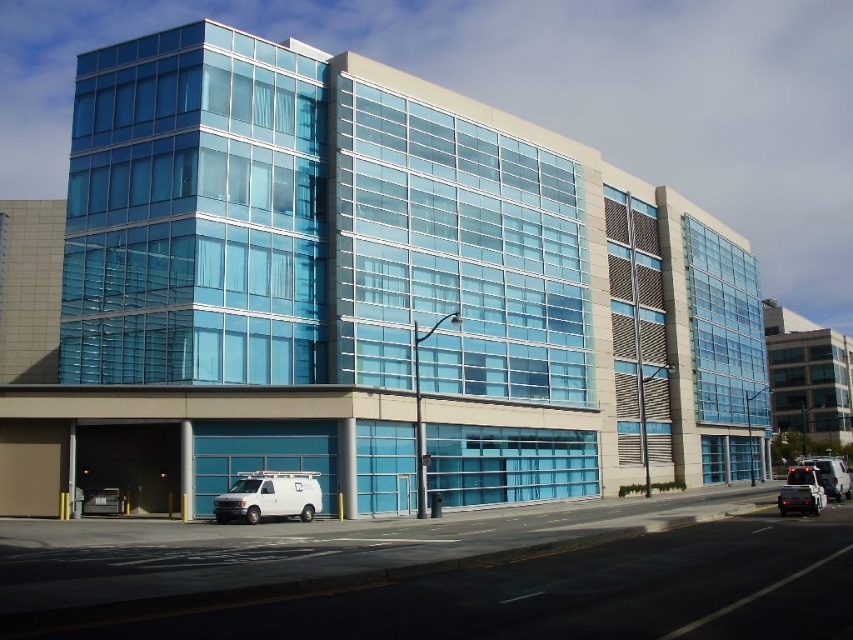
Question: Which object appears farthest from the camera in this image?

Choices:
 (A) metallic silver car at lower right
 (B) shiny black car at lower right
 (C) white matte van at lower center

Answer: (C)

Question: Is shiny black car at lower right further to the viewer compared to metallic silver car at lower right?

Choices:
 (A) yes
 (B) no

Answer: (A)

Question: Which of the following is the farthest from the observer?

Choices:
 (A) (817, 497)
 (B) (283, 484)

Answer: (B)

Question: Is white matte van at lower center behind shiny black car at lower right?

Choices:
 (A) yes
 (B) no

Answer: (A)

Question: Where is white matte van at lower center located in relation to shiny black car at lower right in the image?

Choices:
 (A) right
 (B) left

Answer: (B)

Question: Which point appears closest to the camera in this image?

Choices:
 (A) (778, 493)
 (B) (819, 502)
 (C) (282, 474)

Answer: (B)